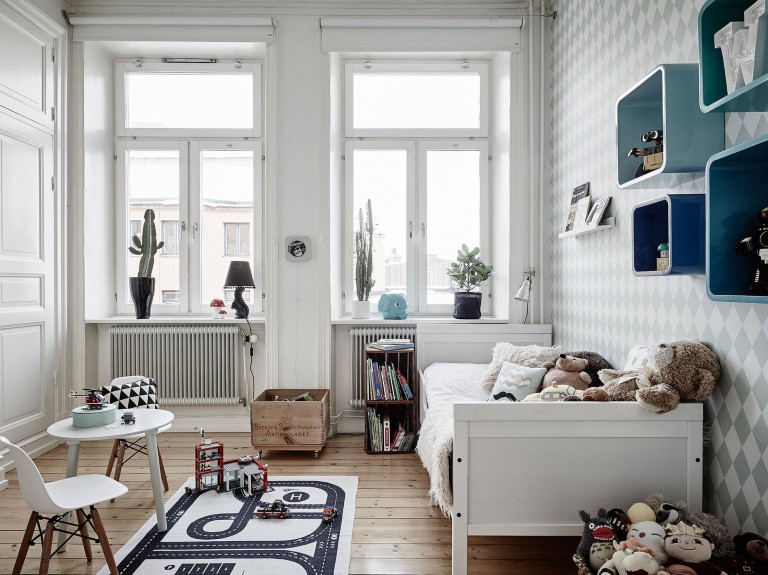
Image resolution: width=768 pixels, height=575 pixels. In order to click on two chairs in this screenshot , I will do `click(64, 501)`, `click(141, 439)`.